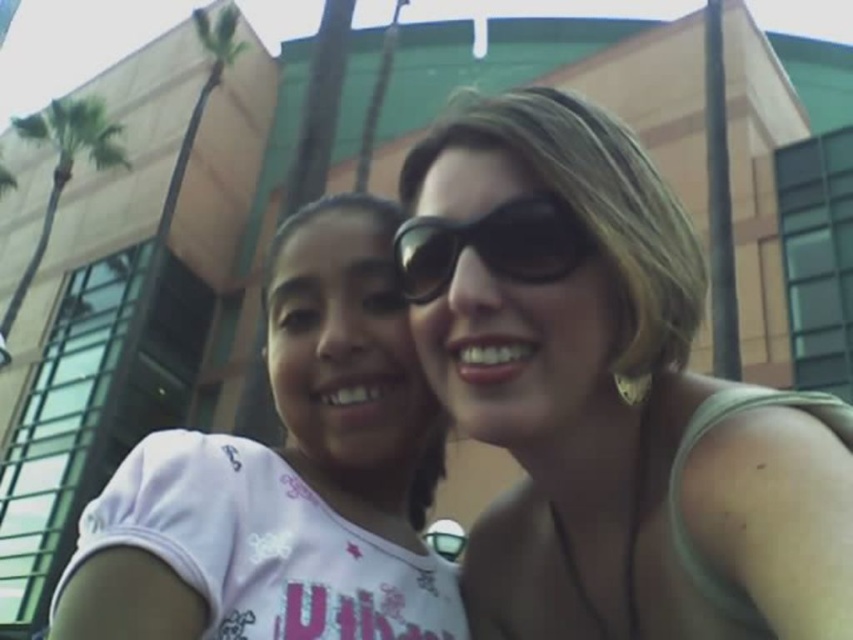
Who is positioned more to the right, white glossy shirt at center or black reflective sunglasses at center?

From the viewer's perspective, black reflective sunglasses at center appears more on the right side.

Between white glossy shirt at center and black reflective sunglasses at center, which one is positioned higher?

black reflective sunglasses at center is higher up.

The height and width of the screenshot is (640, 853). What do you see at coordinates (286, 476) in the screenshot?
I see `white glossy shirt at center` at bounding box center [286, 476].

Image resolution: width=853 pixels, height=640 pixels. In order to click on white glossy shirt at center in this screenshot , I will do `click(286, 476)`.

Measure the distance between white glossy shirt at center and camera.

white glossy shirt at center is 26.38 inches from camera.

Can you confirm if white glossy shirt at center is wider than green leafy palm tree at upper left?

In fact, white glossy shirt at center might be narrower than green leafy palm tree at upper left.

Is point (320, 548) closer to camera compared to point (106, 129)?

Yes, it is.

Where is `white glossy shirt at center`? This screenshot has width=853, height=640. white glossy shirt at center is located at coordinates (286, 476).

Does matte black sunglasses at upper center have a lesser width compared to white glossy shirt at center?

Yes, matte black sunglasses at upper center is thinner than white glossy shirt at center.

Who is more forward, (x=764, y=552) or (x=364, y=496)?

Positioned in front is point (x=764, y=552).

Which is in front, point (474, 637) or point (315, 202)?

Point (474, 637) is more forward.

Identify the location of matte black sunglasses at upper center. (608, 394).